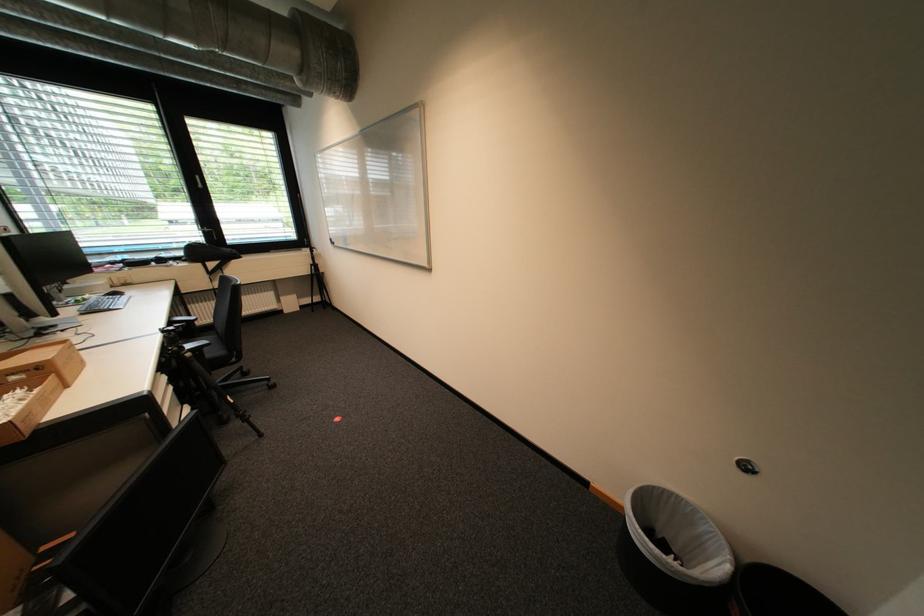
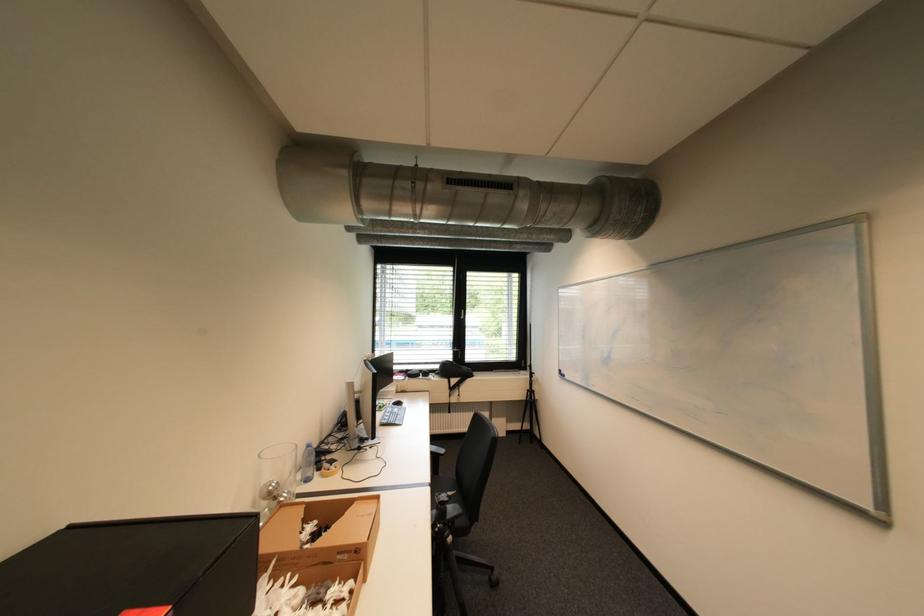
The first image is from the beginning of the video and the second image is from the end. How did the camera likely rotate when shooting the video?

The camera's rotation is toward left-up.